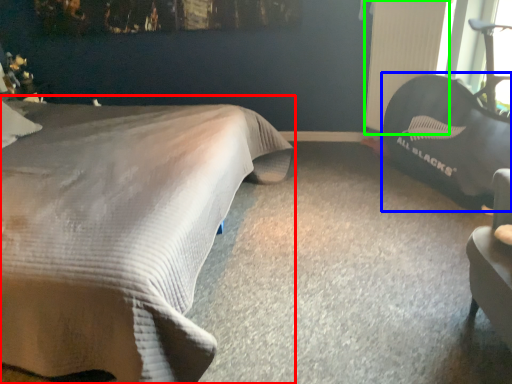
Question: Considering the real-world distances, which object is closest to bed (highlighted by a red box)? bean bag chair (highlighted by a blue box) or radiator (highlighted by a green box).

Choices:
 (A) bean bag chair
 (B) radiator

Answer: (A)